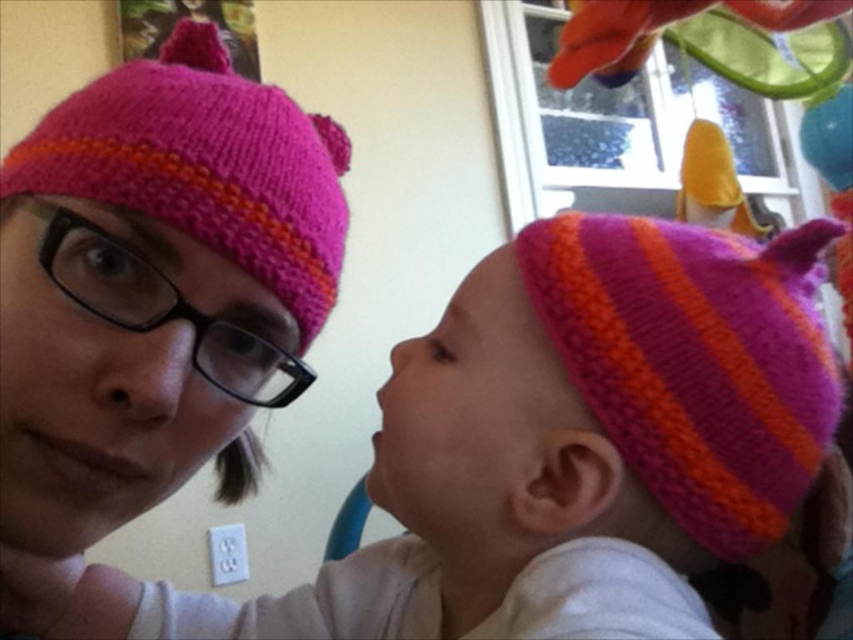
Question: Is pink knitted hat at upper right further to the viewer compared to matte knitted hat at center?

Choices:
 (A) no
 (B) yes

Answer: (A)

Question: Which point is closer to the camera?

Choices:
 (A) matte pink knit hat at upper left
 (B) pink knitted hat at upper right
 (C) matte knitted hat at center

Answer: (B)

Question: Among these objects, which one is nearest to the camera?

Choices:
 (A) matte pink knit hat at upper left
 (B) matte knitted hat at center

Answer: (A)

Question: Estimate the real-world distances between objects in this image. Which object is farther from the matte pink knit hat at upper left?

Choices:
 (A) matte knitted hat at center
 (B) pink knitted hat at upper right

Answer: (A)

Question: Does pink knitted hat at upper right have a greater width compared to matte pink knit hat at upper left?

Choices:
 (A) yes
 (B) no

Answer: (A)

Question: Is matte pink knit hat at upper left in front of matte knitted hat at center?

Choices:
 (A) yes
 (B) no

Answer: (A)